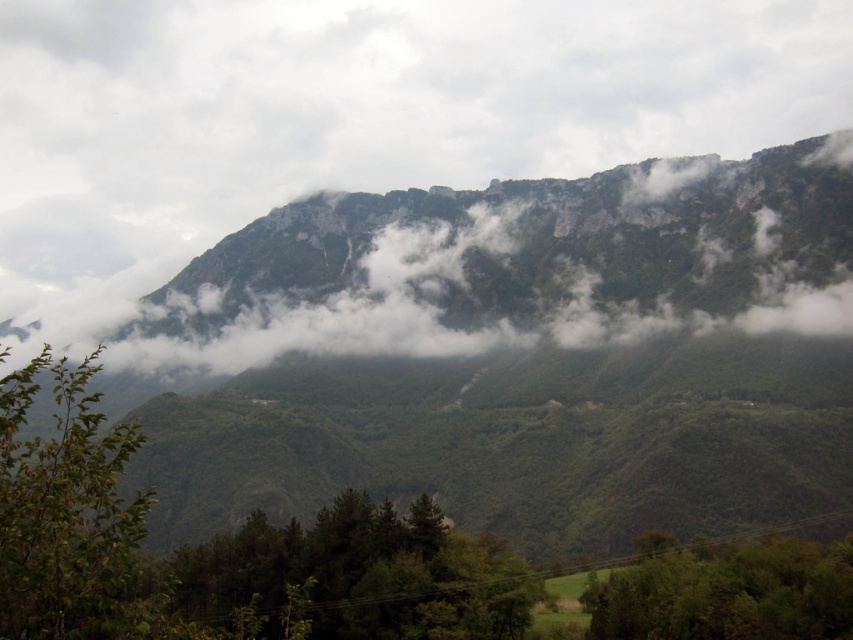
Question: Can you confirm if green leafy tree at lower left is wider than green leafy tree at lower right?

Choices:
 (A) no
 (B) yes

Answer: (B)

Question: Which of the following is the closest to the observer?

Choices:
 (A) green leafy tree at lower center
 (B) white fluffy cloud at upper center
 (C) green leafy tree at lower right

Answer: (A)

Question: Which point appears farthest from the camera in this image?

Choices:
 (A) click(96, 129)
 (B) click(28, 573)
 (C) click(734, 609)

Answer: (A)

Question: Estimate the real-world distances between objects in this image. Which object is farther from the green leafy tree at lower center?

Choices:
 (A) green leafy tree at lower right
 (B) white fluffy cloud at upper center

Answer: (B)

Question: Can you confirm if green leafy tree at lower center is wider than green leafy tree at lower left?

Choices:
 (A) no
 (B) yes

Answer: (B)

Question: Is white fluffy cloud at upper center bigger than green leafy tree at lower center?

Choices:
 (A) yes
 (B) no

Answer: (A)